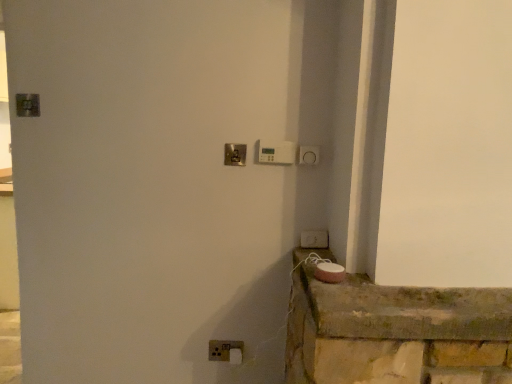
What do you see at coordinates (276, 152) in the screenshot? This screenshot has width=512, height=384. I see `white plastic thermostat at upper center, which is counted as the first light switch, starting from the top` at bounding box center [276, 152].

This screenshot has width=512, height=384. What are the coordinates of `polished brass door handle at center` in the screenshot? It's located at click(x=234, y=154).

Is white plastic light switch at lower center, placed as the 3th light switch when sorted from right to left, in front of or behind pink matte speaker at lower right in the image?

Clearly, white plastic light switch at lower center, placed as the 3th light switch when sorted from right to left, is behind pink matte speaker at lower right.

Can you confirm if white plastic light switch at lower center, placed as the 3th light switch when sorted from right to left, is bigger than pink matte speaker at lower right?

Actually, white plastic light switch at lower center, placed as the 3th light switch when sorted from right to left, might be smaller than pink matte speaker at lower right.

From the image's perspective, which one is positioned higher, white plastic light switch at lower center, placed as the 3th light switch when sorted from right to left, or pink matte speaker at lower right?

pink matte speaker at lower right is shown above in the image.

Is point (217, 348) more distant than point (348, 284)?

That is True.

Who is taller, white plastic light switch at lower right, which appears as the 3th light switch when viewed from the left, or polished brass door handle at center?

polished brass door handle at center is taller.

Is white plastic light switch at lower right, which appears as the 3th light switch when viewed from the left, surrounding polished brass door handle at center?

No, white plastic light switch at lower right, which appears as the 3th light switch when viewed from the left, does not contain polished brass door handle at center.

Is white plastic light switch at lower right, placed as the 1th light switch when sorted from right to left, beside polished brass door handle at center?

white plastic light switch at lower right, placed as the 1th light switch when sorted from right to left, and polished brass door handle at center are clearly separated.

Which object is positioned more to the right, white plastic light switch at lower right, acting as the 2th light switch starting from the bottom, or polished brass door handle at center?

white plastic light switch at lower right, acting as the 2th light switch starting from the bottom.

Which of these two, white plastic thermostat at upper center, which ranks as the second light switch in right-to-left order, or polished brass door handle at center, is thinner?

polished brass door handle at center is thinner.

Is white plastic thermostat at upper center, placed as the 2th light switch when sorted from left to right, oriented away from polished brass door handle at center?

That's not correct — white plastic thermostat at upper center, placed as the 2th light switch when sorted from left to right, is not looking away from polished brass door handle at center.

What's the angular difference between white plastic thermostat at upper center, placed as the 2th light switch when sorted from left to right, and polished brass door handle at center's facing directions?

The angle between the facing direction of white plastic thermostat at upper center, placed as the 2th light switch when sorted from left to right, and the facing direction of polished brass door handle at center is 0.00191 degrees.

Does point (214, 350) lie in front of point (279, 160)?

No, it is behind (279, 160).

Based on the photo, considering the sizes of white plastic light switch at lower center, the 3th light switch in the top-to-bottom sequence, and white plastic thermostat at upper center, which ranks as the second light switch in right-to-left order, in the image, is white plastic light switch at lower center, the 3th light switch in the top-to-bottom sequence, wider or thinner than white plastic thermostat at upper center, which ranks as the second light switch in right-to-left order,?

white plastic light switch at lower center, the 3th light switch in the top-to-bottom sequence, is thinner than white plastic thermostat at upper center, which ranks as the second light switch in right-to-left order.

Who is smaller, white plastic light switch at lower center, placed as the 3th light switch when sorted from right to left, or white plastic thermostat at upper center, which is counted as the first light switch, starting from the top?

white plastic light switch at lower center, placed as the 3th light switch when sorted from right to left, is smaller.

From a real-world perspective, is white plastic light switch at lower center, the 3th light switch in the top-to-bottom sequence, physically below white plastic thermostat at upper center, which is counted as the first light switch, starting from the top?

Indeed, from a real-world perspective, white plastic light switch at lower center, the 3th light switch in the top-to-bottom sequence, is positioned beneath white plastic thermostat at upper center, which is counted as the first light switch, starting from the top.

Considering the relative sizes of white plastic light switch at lower right, which appears as the 3th light switch when viewed from the left, and white plastic thermostat at upper center, placed as the 2th light switch when sorted from left to right, in the image provided, is white plastic light switch at lower right, which appears as the 3th light switch when viewed from the left, smaller than white plastic thermostat at upper center, placed as the 2th light switch when sorted from left to right,?

Yes.

How distant is white plastic light switch at lower right, placed as the 1th light switch when sorted from right to left, from white plastic thermostat at upper center, which ranks as the second light switch in right-to-left order?

The distance of white plastic light switch at lower right, placed as the 1th light switch when sorted from right to left, from white plastic thermostat at upper center, which ranks as the second light switch in right-to-left order, is 34.73 centimeters.

Based on the photo, based on their positions, is white plastic light switch at lower right, acting as the 2th light switch starting from the bottom, located to the left or right of white plastic thermostat at upper center, which ranks as the second light switch in right-to-left order?

white plastic light switch at lower right, acting as the 2th light switch starting from the bottom, is positioned on white plastic thermostat at upper center, which ranks as the second light switch in right-to-left order,'s right side.

Does white plastic light switch at lower right, placed as the 1th light switch when sorted from right to left, contain white plastic thermostat at upper center, which ranks as the second light switch in right-to-left order?

That's incorrect, white plastic thermostat at upper center, which ranks as the second light switch in right-to-left order, is not inside white plastic light switch at lower right, placed as the 1th light switch when sorted from right to left.

Considering the sizes of objects polished brass door handle at center and white plastic thermostat at upper center, which is counted as the first light switch, starting from the top, in the image provided, who is thinner, polished brass door handle at center or white plastic thermostat at upper center, which is counted as the first light switch, starting from the top,?

With smaller width is polished brass door handle at center.

Considering the sizes of objects polished brass door handle at center and white plastic thermostat at upper center, placed as the 2th light switch when sorted from left to right, in the image provided, who is bigger, polished brass door handle at center or white plastic thermostat at upper center, placed as the 2th light switch when sorted from left to right,?

white plastic thermostat at upper center, placed as the 2th light switch when sorted from left to right.

From a real-world perspective, does polished brass door handle at center sit lower than white plastic thermostat at upper center, which is counted as the first light switch, starting from the top?

Yes.

Is pink matte speaker at lower right directly adjacent to polished brass door handle at center?

No, pink matte speaker at lower right is not in contact with polished brass door handle at center.

How different are the orientations of pink matte speaker at lower right and polished brass door handle at center in degrees?

The facing directions of pink matte speaker at lower right and polished brass door handle at center are 0.612 degrees apart.

Could you tell me if pink matte speaker at lower right is facing polished brass door handle at center?

No, pink matte speaker at lower right is not aimed at polished brass door handle at center.

Is pink matte speaker at lower right wider than polished brass door handle at center?

Yes.

Identify the location of the 3rd light switch behind the pink matte speaker at lower right. (226, 351).

Find the location of a particular element. The image size is (512, 384). door handle that is in front of the white plastic light switch at lower right, which appears as the 2th light switch when viewed from the top is located at coordinates (234, 154).

Which object lies further to the anchor point pink matte speaker at lower right, white plastic light switch at lower center, placed as the first light switch when sorted from bottom to top, or polished brass door handle at center?

The object further to pink matte speaker at lower right is polished brass door handle at center.

Estimate the real-world distances between objects in this image. Which object is closer to white plastic light switch at lower center, the 3th light switch in the top-to-bottom sequence, white plastic light switch at lower right, which appears as the 3th light switch when viewed from the left, or polished brass door handle at center?

The object closer to white plastic light switch at lower center, the 3th light switch in the top-to-bottom sequence, is white plastic light switch at lower right, which appears as the 3th light switch when viewed from the left.

When comparing their distances from white plastic light switch at lower right, which appears as the 2th light switch when viewed from the top, does white plastic thermostat at upper center, which ranks as the second light switch in right-to-left order, or white plastic light switch at lower center, placed as the 3th light switch when sorted from right to left, seem closer?

white plastic thermostat at upper center, which ranks as the second light switch in right-to-left order, lies closer to white plastic light switch at lower right, which appears as the 2th light switch when viewed from the top, than the other object.

From the image, which object appears to be nearer to white plastic light switch at lower right, acting as the 2th light switch starting from the bottom, white plastic thermostat at upper center, which is the 3th light switch in bottom-to-top order, or polished brass door handle at center?

Among the two, white plastic thermostat at upper center, which is the 3th light switch in bottom-to-top order, is located nearer to white plastic light switch at lower right, acting as the 2th light switch starting from the bottom.

Considering their positions, is white plastic thermostat at upper center, which is the 3th light switch in bottom-to-top order, positioned closer to polished brass door handle at center than white plastic light switch at lower center, the 3th light switch in the top-to-bottom sequence?

Based on the image, white plastic thermostat at upper center, which is the 3th light switch in bottom-to-top order, appears to be nearer to polished brass door handle at center.

Looking at the image, which one is located further to white plastic light switch at lower center, the 1th light switch positioned from the left, white plastic thermostat at upper center, which is counted as the first light switch, starting from the top, or polished brass door handle at center?

white plastic thermostat at upper center, which is counted as the first light switch, starting from the top, lies further to white plastic light switch at lower center, the 1th light switch positioned from the left, than the other object.

In the scene shown: Looking at the image, which one is located closer to white plastic thermostat at upper center, which is counted as the first light switch, starting from the top, white plastic light switch at lower right, which appears as the 2th light switch when viewed from the top, or white plastic light switch at lower center, placed as the first light switch when sorted from bottom to top?

white plastic light switch at lower right, which appears as the 2th light switch when viewed from the top.

In the scene shown: Looking at the image, which one is located further to white plastic thermostat at upper center, which ranks as the second light switch in right-to-left order, pink matte speaker at lower right or white plastic light switch at lower right, which appears as the 2th light switch when viewed from the top?

Among the two, pink matte speaker at lower right is located further to white plastic thermostat at upper center, which ranks as the second light switch in right-to-left order.

Find the location of a particular element. light switch located between pink matte speaker at lower right and polished brass door handle at center in the depth direction is located at coordinates (276, 152).

The height and width of the screenshot is (384, 512). I want to click on door handle that lies between white plastic thermostat at upper center, which is counted as the first light switch, starting from the top, and white plastic light switch at lower center, placed as the 3th light switch when sorted from right to left, from top to bottom, so click(234, 154).

Where is `light switch between pink matte speaker at lower right and white plastic light switch at lower right, acting as the 2th light switch starting from the bottom, from front to back`? The image size is (512, 384). light switch between pink matte speaker at lower right and white plastic light switch at lower right, acting as the 2th light switch starting from the bottom, from front to back is located at coordinates (276, 152).

Identify the location of ledge that lies between polished brass door handle at center and white plastic light switch at lower center, the 1th light switch positioned from the left, from top to bottom. (396, 333).